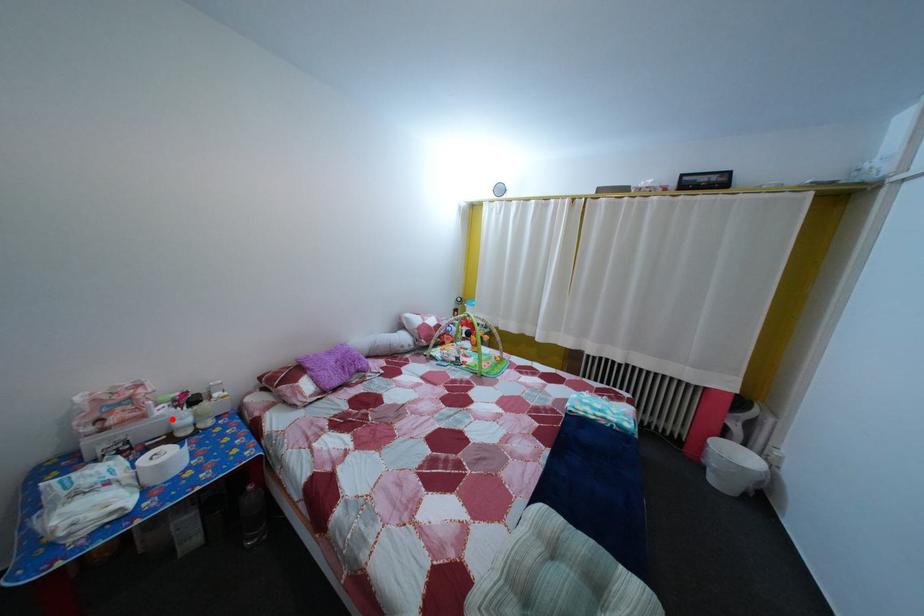
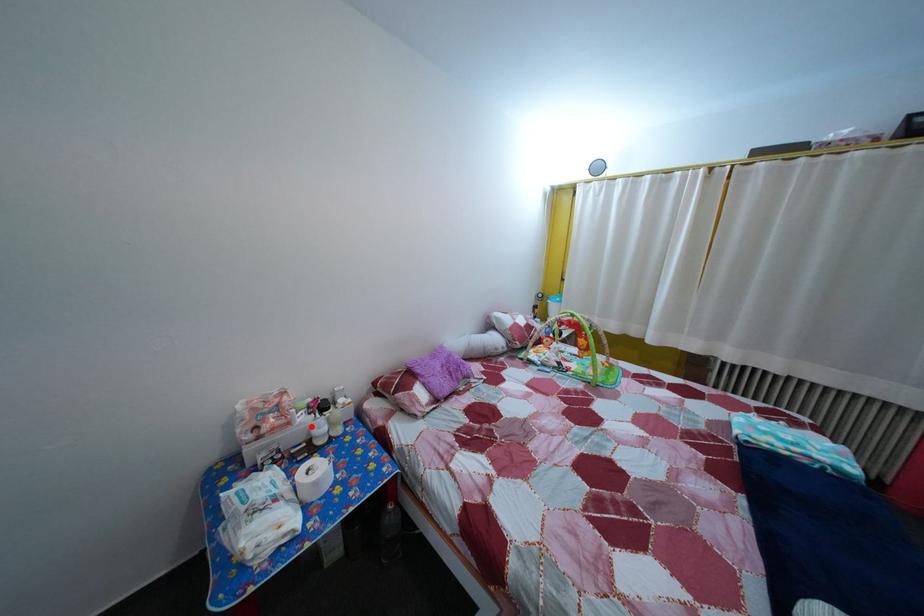
I am providing you with two images of the same scene from different viewpoints. A red point is marked on the first image and another point is marked on the second image. Is the red point in image1 aligned with the point shown in image2?

Yes